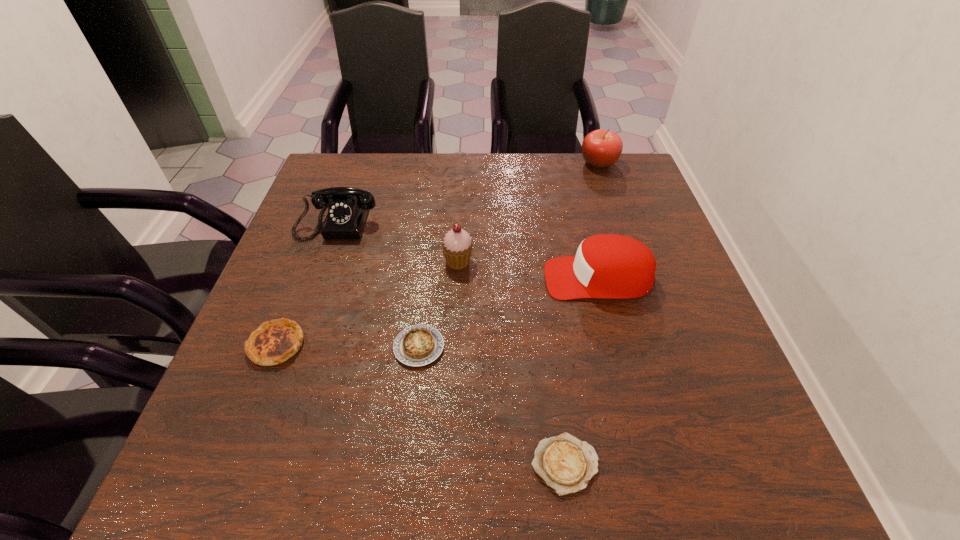
At what (x,y) coordinates should I click in order to perform the action: click on empty location between the cupcake and the nearest object. Please return your answer as a coordinate pair (x, y). This screenshot has width=960, height=540. Looking at the image, I should click on (512, 362).

The height and width of the screenshot is (540, 960). What are the coordinates of `vacant space that is in between the apple and the sixth tallest object` in the screenshot? It's located at (509, 255).

Where is `vacant point located between the rightmost quiche and the baseball cap`? vacant point located between the rightmost quiche and the baseball cap is located at coordinates (582, 371).

Locate an element on the screen. The height and width of the screenshot is (540, 960). vacant space that is in between the apple and the second shortest quiche is located at coordinates (509, 255).

Identify which object is the third closest to the cupcake. Please provide its 2D coordinates. Your answer should be formatted as a tuple, i.e. [(x, y)], where the tuple contains the x and y coordinates of a point satisfying the conditions above.

[(347, 207)]

Locate an element on the screen. The width and height of the screenshot is (960, 540). the fourth closest object to the second farthest object is located at coordinates (610, 266).

Locate an element on the screen. The width and height of the screenshot is (960, 540). the second closest quiche to the cupcake is located at coordinates (274, 342).

Locate an element on the screen. Image resolution: width=960 pixels, height=540 pixels. quiche that is the nearest to the cupcake is located at coordinates (418, 345).

I want to click on free space that satisfies the following two spatial constraints: 1. on the dial of the telephone; 2. on the right side of the cupcake, so click(x=324, y=261).

Find the location of `free space that satisfies the following two spatial constraints: 1. on the dial of the telephone; 2. on the right side of the second tallest quiche`. free space that satisfies the following two spatial constraints: 1. on the dial of the telephone; 2. on the right side of the second tallest quiche is located at coordinates pyautogui.click(x=295, y=347).